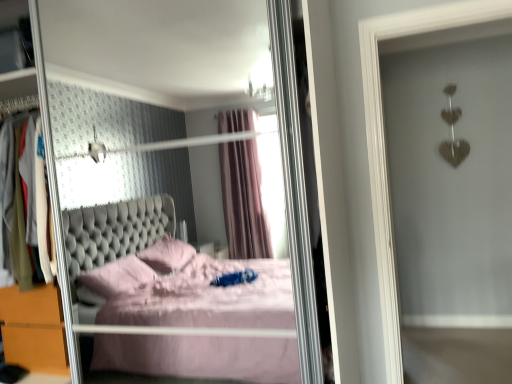
What do you see at coordinates (294, 142) in the screenshot?
I see `transparent glass door at center` at bounding box center [294, 142].

In order to face transparent glass door at center, should I rotate leftwards or rightwards?

Rotate left and turn 18.891 degrees.

In order to click on transparent glass door at center in this screenshot , I will do `click(294, 142)`.

Where is `transparent glass door at center`? The image size is (512, 384). transparent glass door at center is located at coordinates (294, 142).